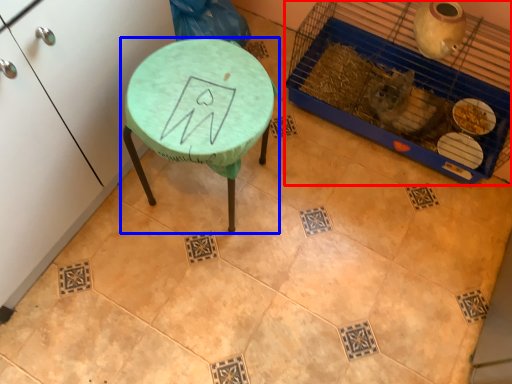
Question: Which object is further to the camera taking this photo, bird cage (highlighted by a red box) or table (highlighted by a blue box)?

Choices:
 (A) bird cage
 (B) table

Answer: (A)